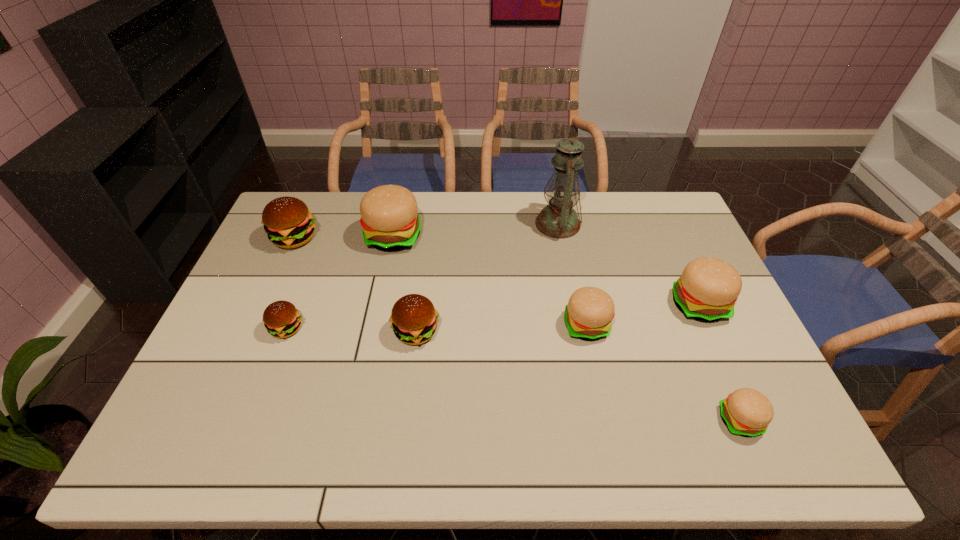
Where is `oil lamp`? The image size is (960, 540). oil lamp is located at coordinates (559, 220).

Where is `the biggest beige hamburger`? the biggest beige hamburger is located at coordinates (389, 218).

This screenshot has width=960, height=540. What are the coordinates of `the farthest beige hamburger` in the screenshot? It's located at (389, 218).

The image size is (960, 540). I want to click on the biggest brown hamburger, so click(x=288, y=223).

Where is `the third smallest beige hamburger`? Image resolution: width=960 pixels, height=540 pixels. the third smallest beige hamburger is located at coordinates (708, 288).

Where is `the rightmost brown hamburger`? the rightmost brown hamburger is located at coordinates (414, 319).

Locate an element on the screen. The image size is (960, 540). the third hamburger from right to left is located at coordinates (590, 310).

In order to click on the second smallest beige hamburger in this screenshot , I will do `click(590, 310)`.

Locate an element on the screen. This screenshot has width=960, height=540. the smallest brown hamburger is located at coordinates (281, 318).

The width and height of the screenshot is (960, 540). I want to click on the nearest object, so click(x=747, y=412).